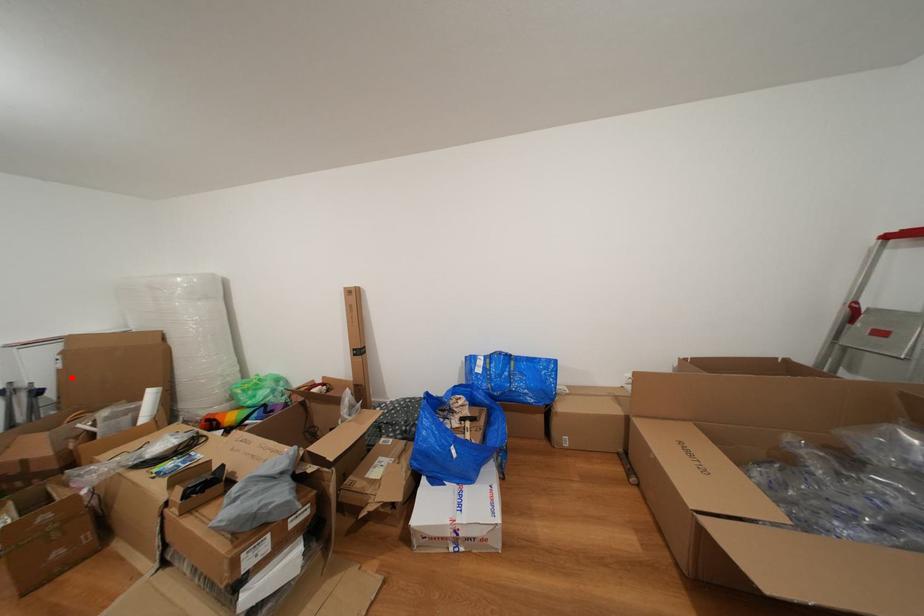
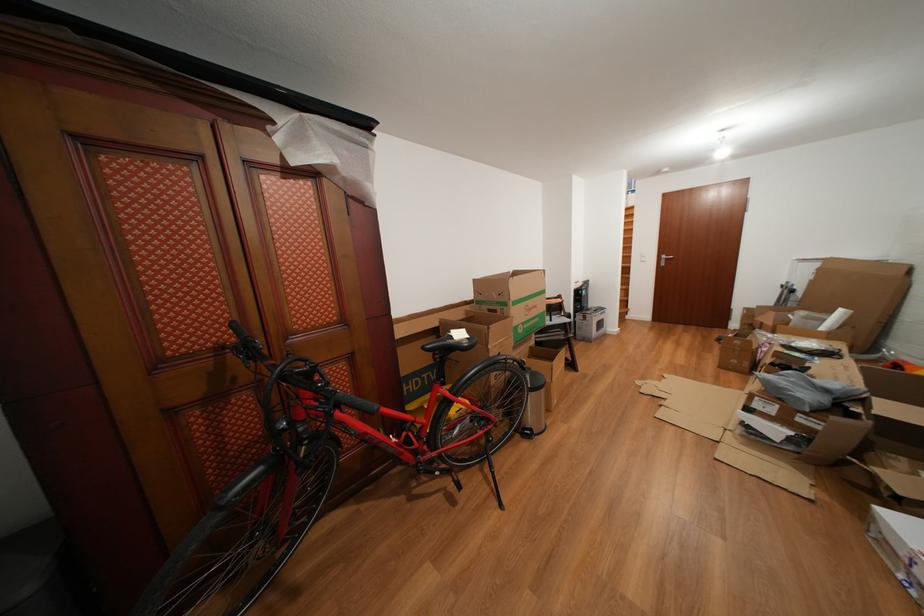
The point at the highlighted location is marked in the first image. Where is the corresponding point in the second image?

(821, 288)